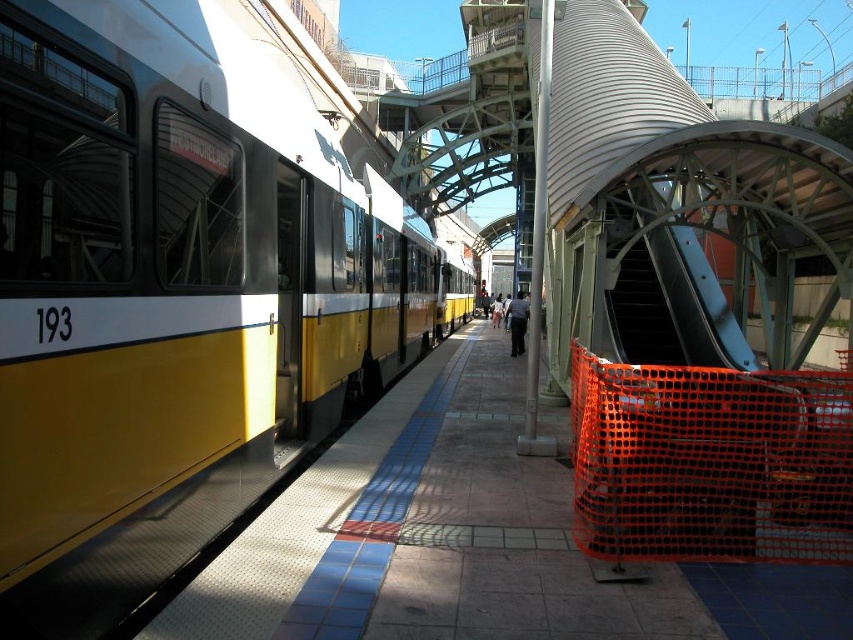
Question: Is yellow matte train at left to the right of black uniform at center from the viewer's perspective?

Choices:
 (A) no
 (B) yes

Answer: (A)

Question: Which of the following is the closest to the observer?

Choices:
 (A) (515, 321)
 (B) (97, 248)

Answer: (B)

Question: Can you confirm if yellow matte train at left is positioned below black uniform at center?

Choices:
 (A) no
 (B) yes

Answer: (B)

Question: Can you confirm if yellow matte train at left is positioned above black uniform at center?

Choices:
 (A) no
 (B) yes

Answer: (A)

Question: Which object appears farthest from the camera in this image?

Choices:
 (A) black uniform at center
 (B) yellow matte train at left

Answer: (A)